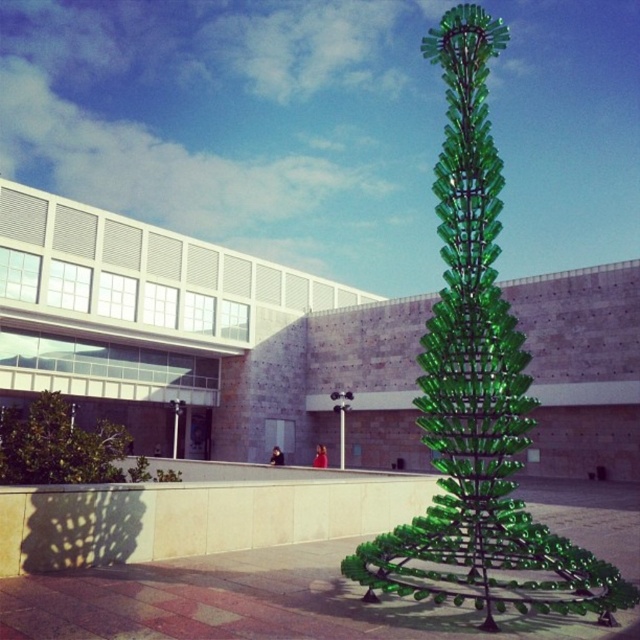
Based on the photo, does green glass sculpture at center have a greater height compared to green glass tree at lower left?

Correct, green glass sculpture at center is much taller as green glass tree at lower left.

Between green glass sculpture at center and green glass tree at lower left, which one is positioned higher?

green glass sculpture at center is above.

Between point (460, 132) and point (88, 445), which one is positioned behind?

Point (88, 445)

Find the location of a particular element. green glass sculpture at center is located at coordinates (477, 392).